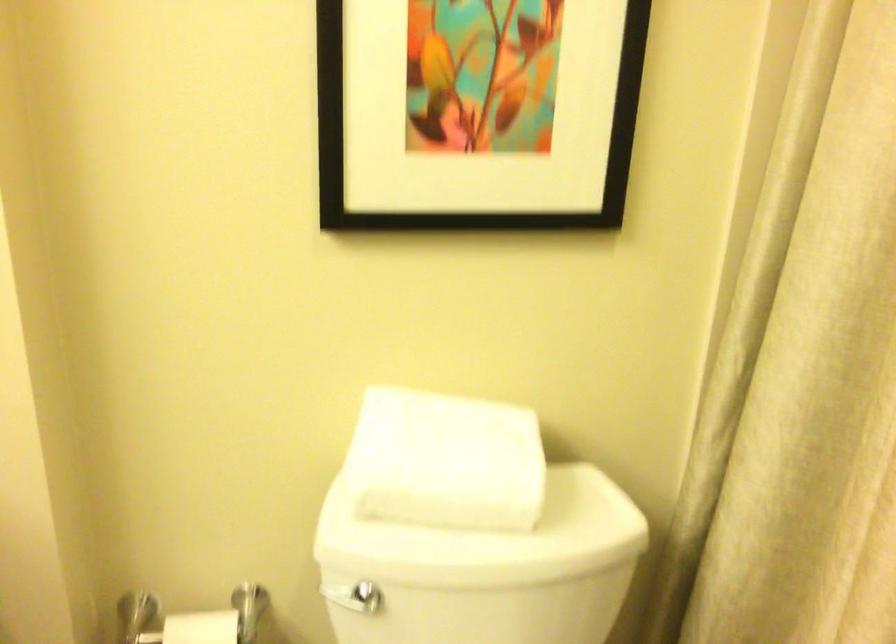
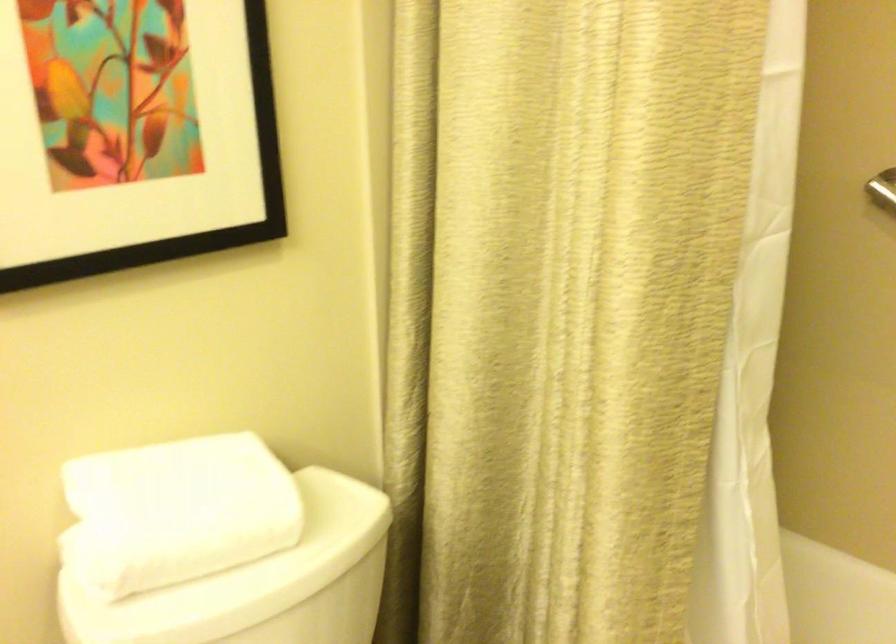
Question: The images are taken continuously from a first-person perspective. In which direction is your viewpoint rotating?

Choices:
 (A) Left
 (B) Right
 (C) Up
 (D) Down

Answer: (B)